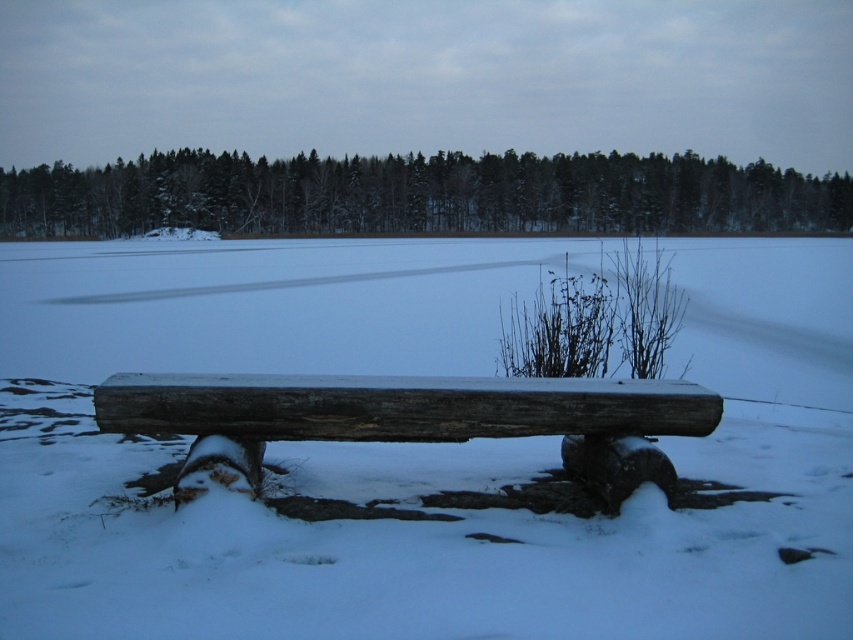
Question: Estimate the real-world distances between objects in this image. Which object is closer to the green matte trees at upper center?

Choices:
 (A) white snow at center
 (B) weathered wood bench at center

Answer: (A)

Question: Based on their relative distances, which object is farther from the weathered wood bench at center?

Choices:
 (A) green matte trees at upper center
 (B) white snow at center

Answer: (A)

Question: Can you confirm if white snow at center is positioned to the right of weathered wood bench at center?

Choices:
 (A) yes
 (B) no

Answer: (A)

Question: Can you confirm if green matte trees at upper center is thinner than weathered wood bench at center?

Choices:
 (A) no
 (B) yes

Answer: (A)

Question: Which object is the farthest from the weathered wood bench at center?

Choices:
 (A) green matte trees at upper center
 (B) white snow at center

Answer: (A)

Question: Is green matte trees at upper center further to the viewer compared to weathered wood bench at center?

Choices:
 (A) yes
 (B) no

Answer: (A)